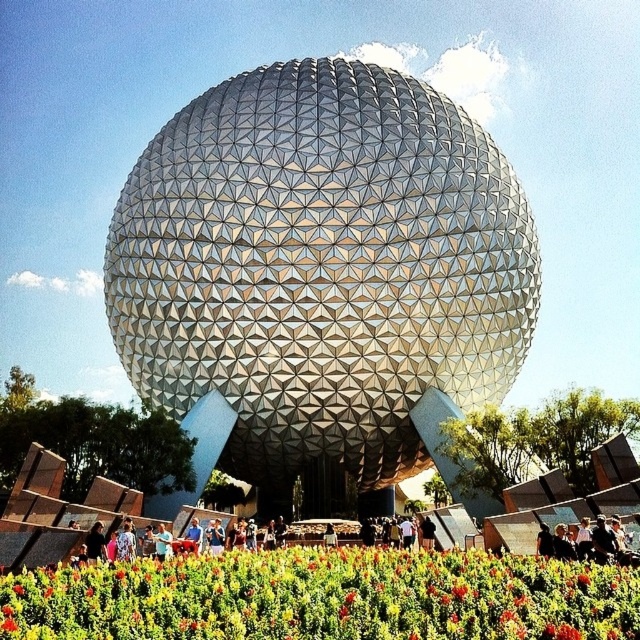
Question: Does white textured sphere at center come behind metallic sphere at center?

Choices:
 (A) no
 (B) yes

Answer: (B)

Question: Is white textured sphere at center to the right of metallic sphere at center from the viewer's perspective?

Choices:
 (A) no
 (B) yes

Answer: (A)

Question: Is white textured sphere at center below vibrant floral carpet at center?

Choices:
 (A) no
 (B) yes

Answer: (A)

Question: Among these objects, which one is farthest from the camera?

Choices:
 (A) vibrant floral carpet at center
 (B) metallic sphere at center
 (C) white textured sphere at center

Answer: (C)

Question: Which point appears closest to the camera in this image?

Choices:
 (A) (349, 556)
 (B) (116, 312)
 (C) (372, 547)

Answer: (A)

Question: Which object appears farthest from the camera in this image?

Choices:
 (A) metallic sphere at center
 (B) white textured sphere at center
 (C) vibrant floral carpet at center

Answer: (B)